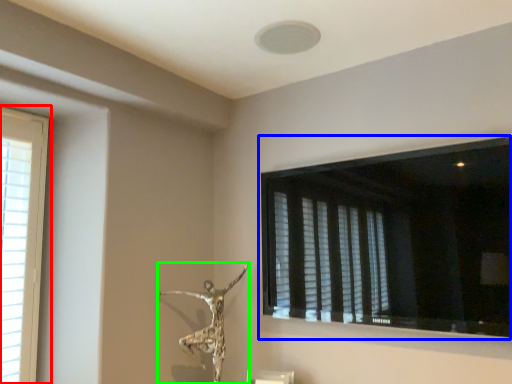
Question: Considering the real-world distances, which object is closest to window (highlighted by a red box)? window (highlighted by a blue box) or sculpture (highlighted by a green box).

Choices:
 (A) window
 (B) sculpture

Answer: (B)